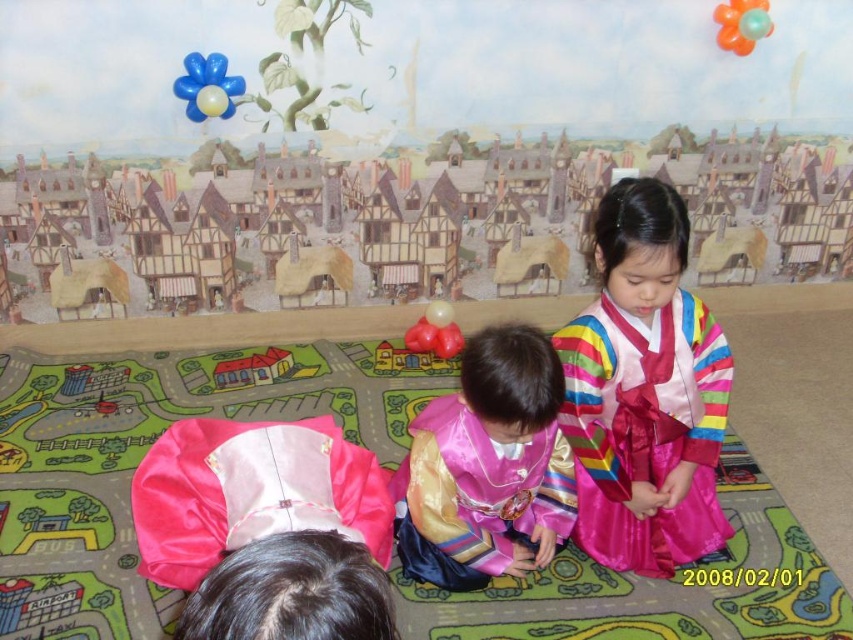
You are a child in the playroom holding a blue glossy balloon at upper left. You want to place it on top of the matte plastic house at center. Will the balloon fit on the house without overlapping the edges?

The blue glossy balloon at upper left has a width less than the matte plastic house at center, so it will fit without overlapping the edges.

You are a photographer planning to capture a wide shot of the scene. You need to ensure that both the pink satin kimono at lower left and the translucent orange balloon at upper right are fully visible in the frame. Given their sizes, which object might require you to adjust your camera angle to avoid cropping? Explain your reasoning.

The pink satin kimono at lower left has a greater width than the translucent orange balloon at upper right. Since it is wider, the photographer may need to adjust the camera angle to ensure the entire kimono is captured without cropping, especially if the frame is constrained by the balloon or other elements in the scene.